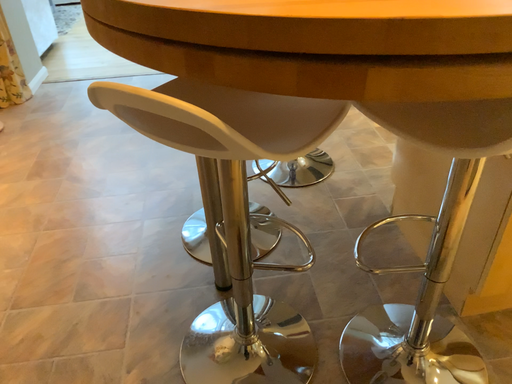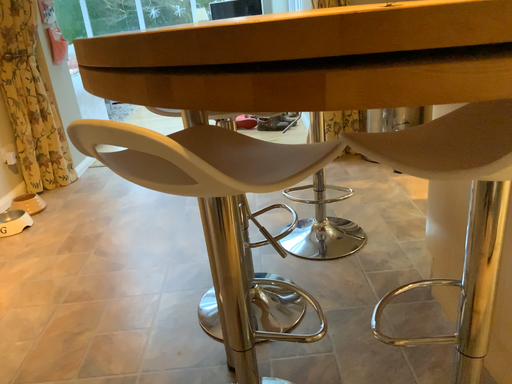
Question: Which way did the camera rotate in the video?

Choices:
 (A) rotated downward
 (B) rotated upward

Answer: (B)